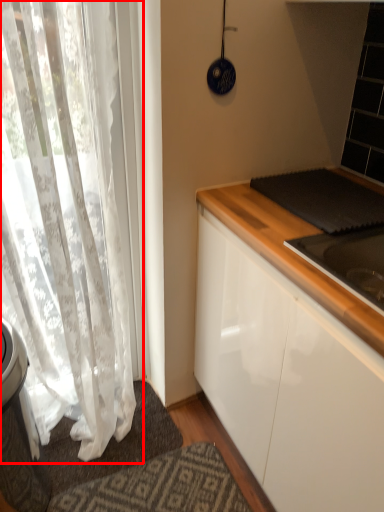
Question: From the image's perspective, what is the correct spatial relationship of curtain (annotated by the red box) in relation to doormat?

Choices:
 (A) below
 (B) above

Answer: (B)